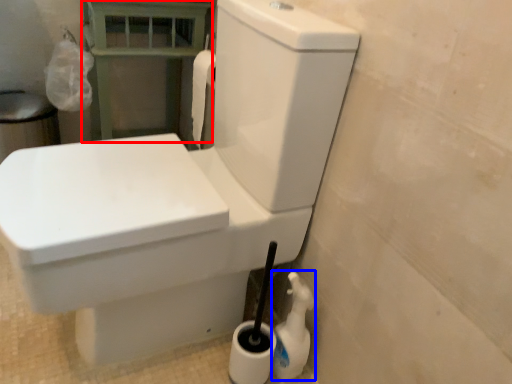
Question: Which object appears closest to the camera in this image, balustrade (highlighted by a red box) or cleaning product (highlighted by a blue box)?

Choices:
 (A) balustrade
 (B) cleaning product

Answer: (B)